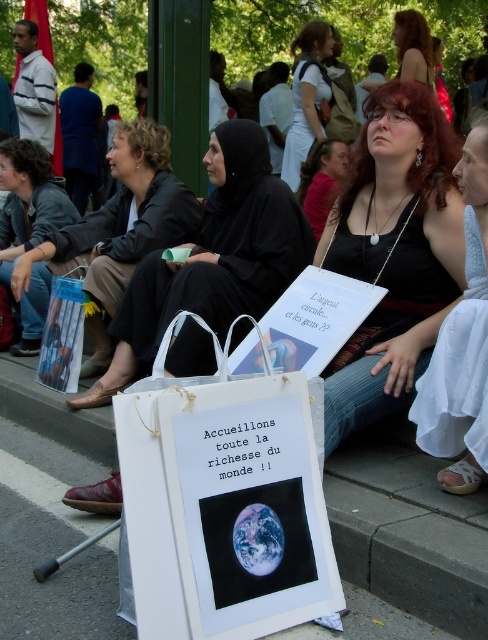
You are organizing a picnic and need to place the white paper bag at center and the denim jacket at left. Given their sizes, which one can hold more items?

The white paper bag at center has a greater width than the denim jacket at left, so it can hold more items.

You are a photographer trying to capture a closeup of the white paper sign at center and the matte black hijab at center. Based on their positions, which object should you focus on first to ensure both are in frame?

The white paper sign at center is below the matte black hijab at center, so you should focus on the matte black hijab at center first to ensure both are in frame.